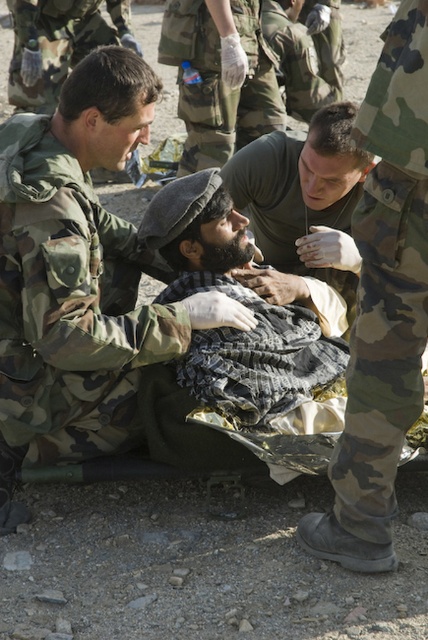
Based on the photo, you are a photographer trying to capture a photo of the scene. You want to ensure both the camo fabric pants at right and the camouflage fabric uniform at upper left are visible in your shot. Based on their positions, which object should you focus on first to ensure both are in frame?

The camouflage fabric uniform at upper left should be focused on first since the camo fabric pants at right is below it, ensuring both will be in frame when starting from the upper position.

You are a medic in the field and need to determine which item is bigger between the camouflage uniform at center and the dark gray fabric at center. Which one is larger?

The camouflage uniform at center is larger in size than the dark gray fabric at center according to the description.